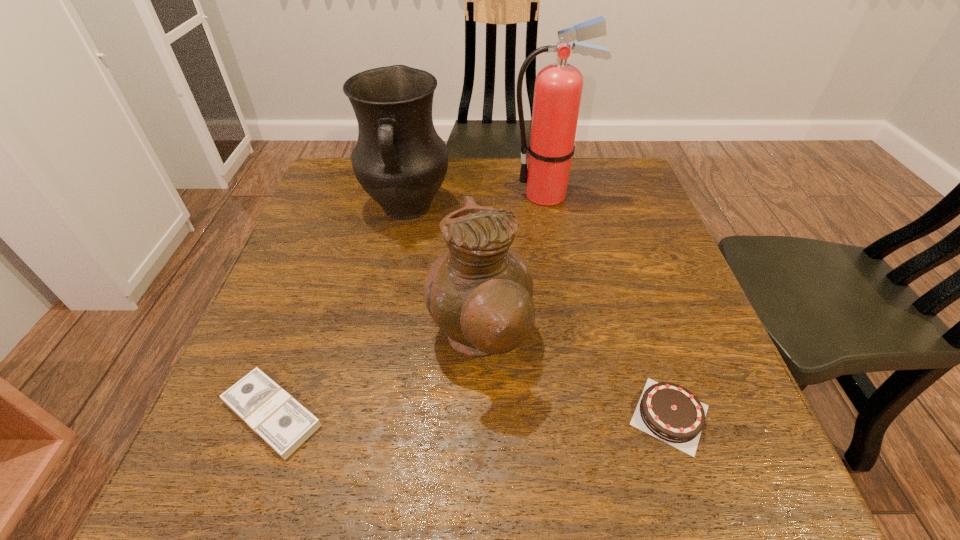
This screenshot has height=540, width=960. Find the location of `free space between the tallest object and the shortest object`. free space between the tallest object and the shortest object is located at coordinates (409, 304).

Locate an element on the screen. This screenshot has width=960, height=540. free point between the dollar and the tallest object is located at coordinates (409, 304).

Where is `vacant space that's between the fire extinguisher and the farther pitcher`? The height and width of the screenshot is (540, 960). vacant space that's between the fire extinguisher and the farther pitcher is located at coordinates (477, 201).

I want to click on free spot between the dollar and the nearer pitcher, so click(x=375, y=376).

What are the coordinates of `vacant space that's between the dollar and the fire extinguisher` in the screenshot? It's located at 409,304.

Image resolution: width=960 pixels, height=540 pixels. I want to click on the third closest object to the shortest object, so click(667, 411).

The image size is (960, 540). Find the location of `object identified as the closest to the fire extinguisher`. object identified as the closest to the fire extinguisher is located at coordinates (399, 159).

Find the location of `free location that satisfies the following two spatial constraints: 1. on the hose direction of the tallest object; 2. on the handle side of the farther pitcher`. free location that satisfies the following two spatial constraints: 1. on the hose direction of the tallest object; 2. on the handle side of the farther pitcher is located at coordinates (549, 207).

The image size is (960, 540). Find the location of `vacant point that satisfies the following two spatial constraints: 1. on the hose direction of the tallest object; 2. on the left side of the second shortest object`. vacant point that satisfies the following two spatial constraints: 1. on the hose direction of the tallest object; 2. on the left side of the second shortest object is located at coordinates (588, 415).

The height and width of the screenshot is (540, 960). I want to click on vacant point that satisfies the following two spatial constraints: 1. on the hose direction of the tallest object; 2. on the handle side of the farther pitcher, so click(x=549, y=207).